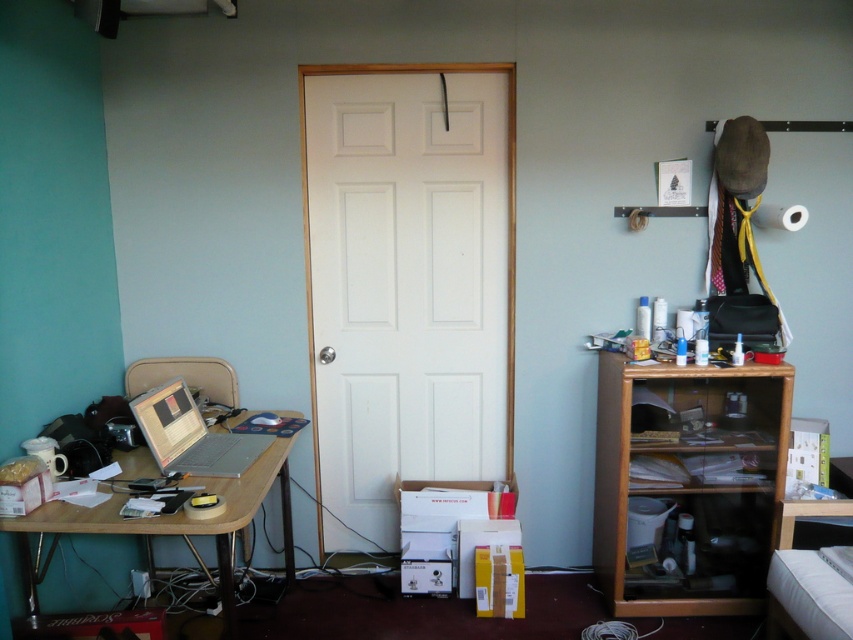
You are moving a 1.5 meter long ladder from the wooden desk at left to the wooden cabinet at right. Can you fit the ladder through the space between them without bending it?

The distance between the wooden cabinet at right and wooden desk at left is 1.37 meters. Since the ladder is 1.5 meters long, it cannot fit through the space without bending it.

Consider the image. You are organizing your workspace in the room. You need to move a box from the wooden desk at left to the wooden cabinet at right. Which direction should you move the box?

The wooden cabinet at right is to the right of the wooden desk at left, so you should move the box to the right direction.

You are organizing items in a small room and need to place both the wooden cabinet at right and the silver metallic laptop at left. Given their sizes, which object requires more horizontal space on the desk?

The wooden cabinet at right requires more horizontal space because its width surpasses that of the silver metallic laptop at left.